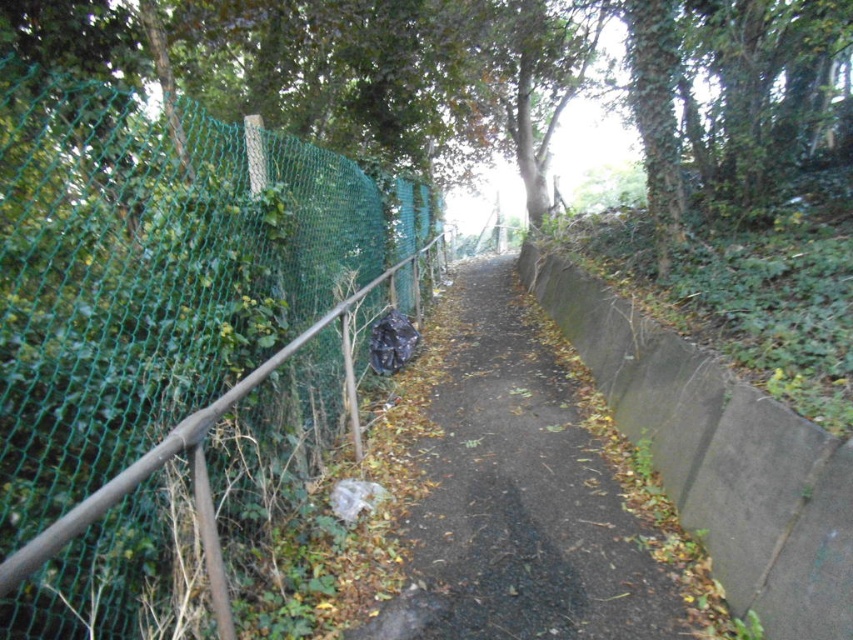
Question: Can you confirm if black asphalt path at center is thinner than brown metal/rusty rail at left?

Choices:
 (A) yes
 (B) no

Answer: (B)

Question: Does black asphalt path at center appear on the left side of brown metal/rusty rail at left?

Choices:
 (A) no
 (B) yes

Answer: (A)

Question: Among these objects, which one is nearest to the camera?

Choices:
 (A) black asphalt path at center
 (B) brown metal/rusty rail at left

Answer: (B)

Question: Is black asphalt path at center positioned in front of brown metal/rusty rail at left?

Choices:
 (A) yes
 (B) no

Answer: (B)